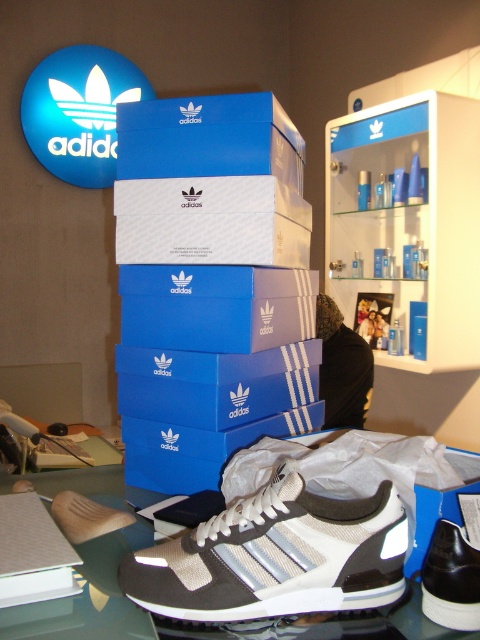
Can you confirm if white textured sneaker at center is shorter than black leather shoe at lower right?

In fact, white textured sneaker at center may be taller than black leather shoe at lower right.

Can you confirm if white textured sneaker at center is positioned to the left of black leather shoe at lower right?

Indeed, white textured sneaker at center is positioned on the left side of black leather shoe at lower right.

Does point (231, 516) lie behind point (455, 566)?

Yes.

Where is `white textured sneaker at center`? white textured sneaker at center is located at coordinates point(276,556).

Is point (244, 260) farther from viewer compared to point (284, 484)?

That is True.

The width and height of the screenshot is (480, 640). What are the coordinates of `blue cardboard box at center` in the screenshot? It's located at (213, 282).

Who is lower down, blue cardboard box at center or blue matte shoebox at upper center?

blue cardboard box at center

Does blue cardboard box at center have a lesser width compared to blue matte shoebox at upper center?

In fact, blue cardboard box at center might be wider than blue matte shoebox at upper center.

Which is behind, point (309, 282) or point (269, 102)?

Positioned behind is point (309, 282).

Identify the location of blue cardboard box at center. (213, 282).